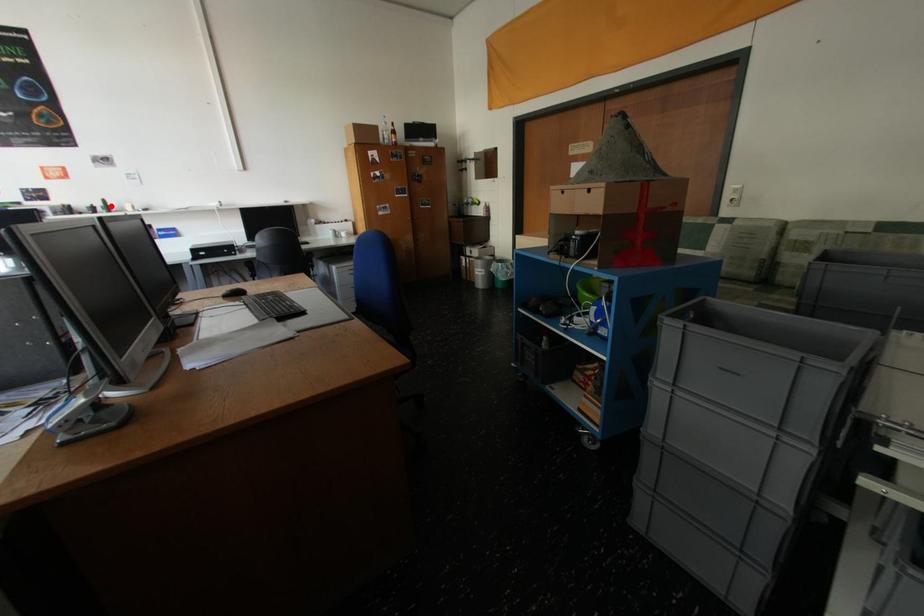
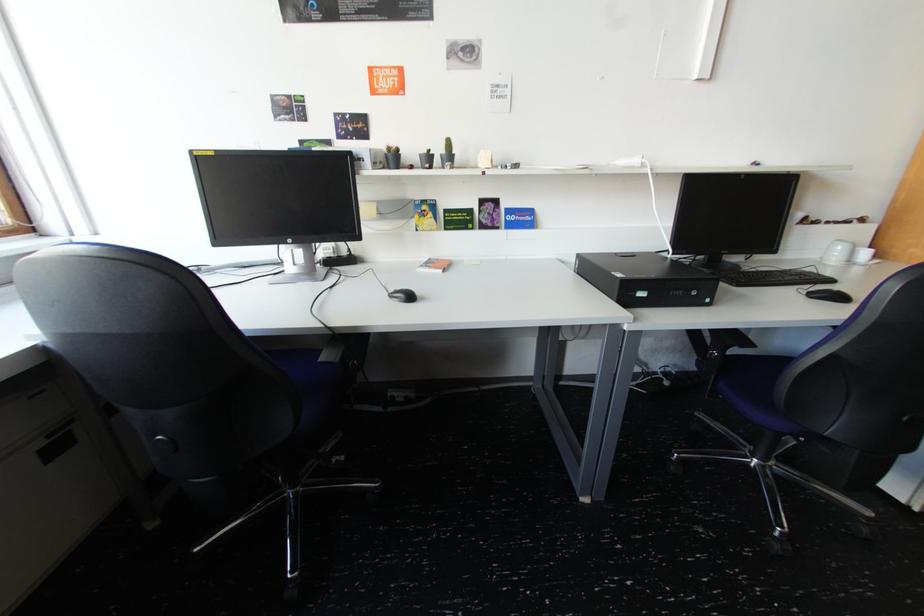
Where in the second image is the point corresponding to the highlighted location from the first image?

(452, 152)